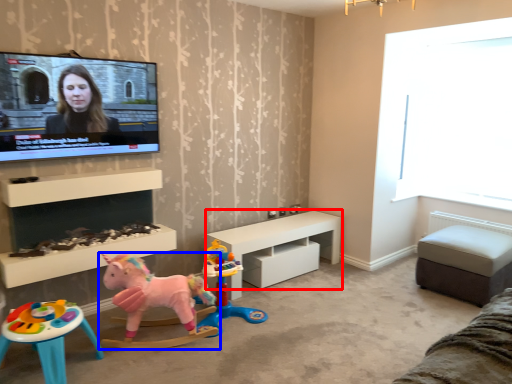
Question: Among these objects, which one is nearest to the camera, table (highlighted by a red box) or toy (highlighted by a blue box)?

Choices:
 (A) table
 (B) toy

Answer: (B)